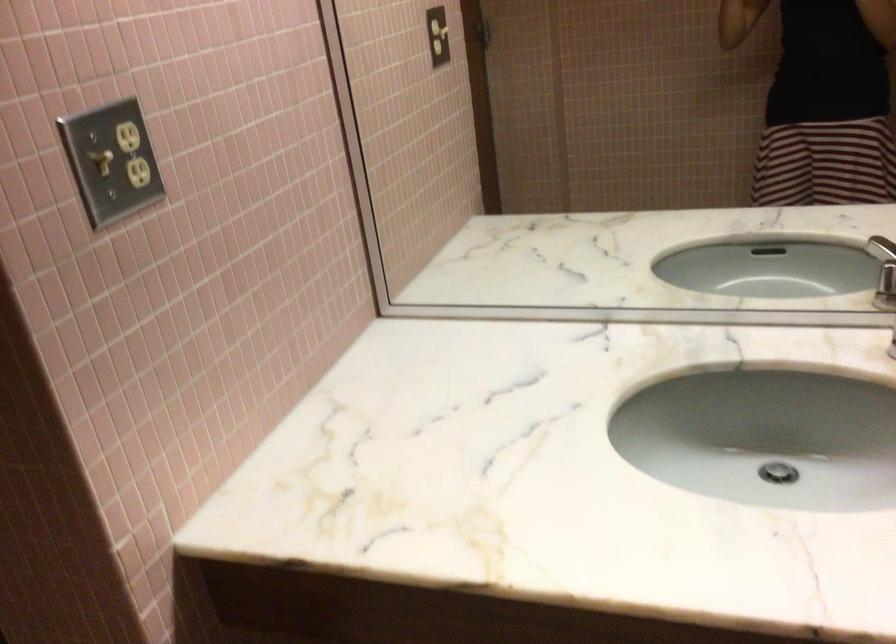
What do you see at coordinates (99, 158) in the screenshot? Image resolution: width=896 pixels, height=644 pixels. I see `a metal light switch` at bounding box center [99, 158].